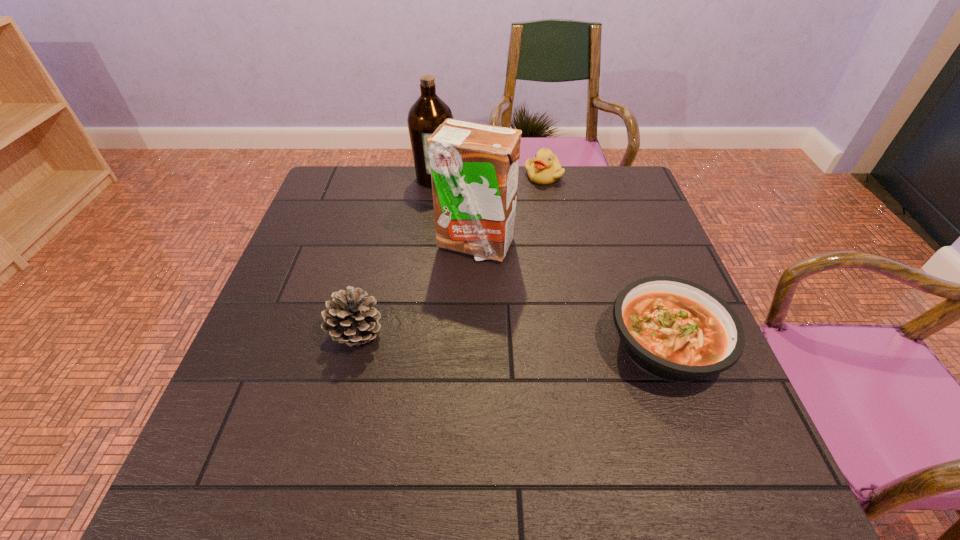
I want to click on the third tallest object, so click(351, 319).

At what (x,y) coordinates should I click in order to perform the action: click on the rightmost object. Please return your answer as a coordinate pair (x, y). The height and width of the screenshot is (540, 960). Looking at the image, I should click on (673, 329).

The width and height of the screenshot is (960, 540). Identify the location of olive oil. (429, 111).

Locate an element on the screen. Image resolution: width=960 pixels, height=540 pixels. carton is located at coordinates (474, 167).

Where is `duckling`? duckling is located at coordinates coord(544,169).

The image size is (960, 540). I want to click on free point located 0.080m on the front of the pinecone, so pos(343,390).

You are a GUI agent. You are given a task and a screenshot of the screen. Output one action in this format:
    pyautogui.click(x=<x>, y=<y>)
    Task: Click on the free space located 0.080m on the left of the stew
    
    Given the screenshot: What is the action you would take?
    pyautogui.click(x=569, y=346)

Identify the location of free space located 0.310m on the label of the olive oil. (486, 249).

You are a GUI agent. You are given a task and a screenshot of the screen. Output one action in this format:
    pyautogui.click(x=<x>, y=<y>)
    Task: Click on the free space located on the label of the olive oil
    The height and width of the screenshot is (540, 960).
    Given the screenshot: What is the action you would take?
    pyautogui.click(x=486, y=249)

Locate an element on the screen. free spot located 0.110m on the label of the olive oil is located at coordinates (457, 208).